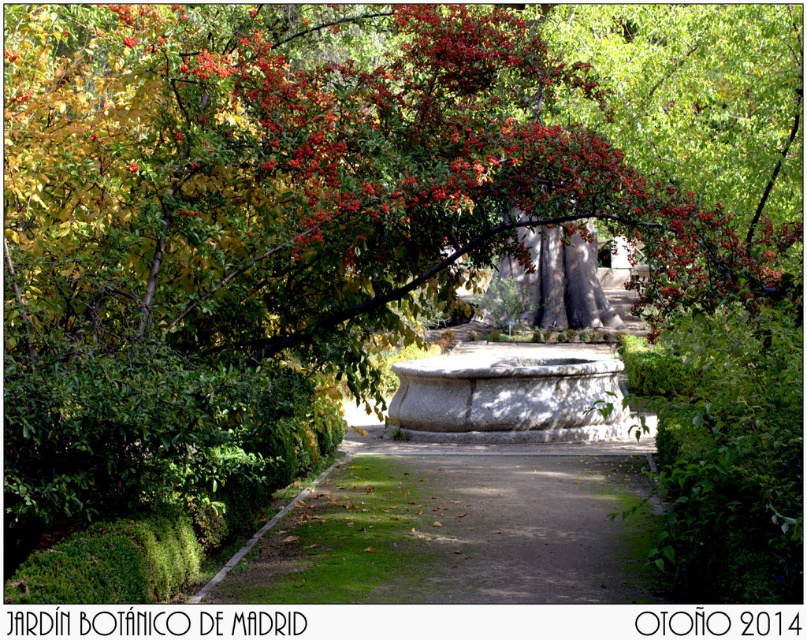
You are standing at the point labeled as point (454, 529) in the garden. What is the immediate surface you are standing on?

The immediate surface at point (454, 529) is the green gravel path at center.

You are a gardener planning to place a decorative statue that is 1.2 meters wide in the garden. You want to position it near the granite fountain at center. Based on the scene, can the statue be placed without overlapping the green glossy leaves at upper center?

The green glossy leaves at upper center are wider than the granite fountain at center. Since the statue is 1.2 meters wide and the fountain is narrower than the leaves, placing the statue near the fountain might cause it to overlap with the leaves if their width exceeds the available space. However, without exact measurements of the leaves and fountain, it is uncertain. Please check the actual dimensions before placement.

You are standing in the garden and want to take a photo of both the point at location (168,323) and the point at (513,552). Which point will appear larger in your camera view?

The point at location (168,323) will appear larger in the camera view because it is closer to the camera than the point at (513,552).